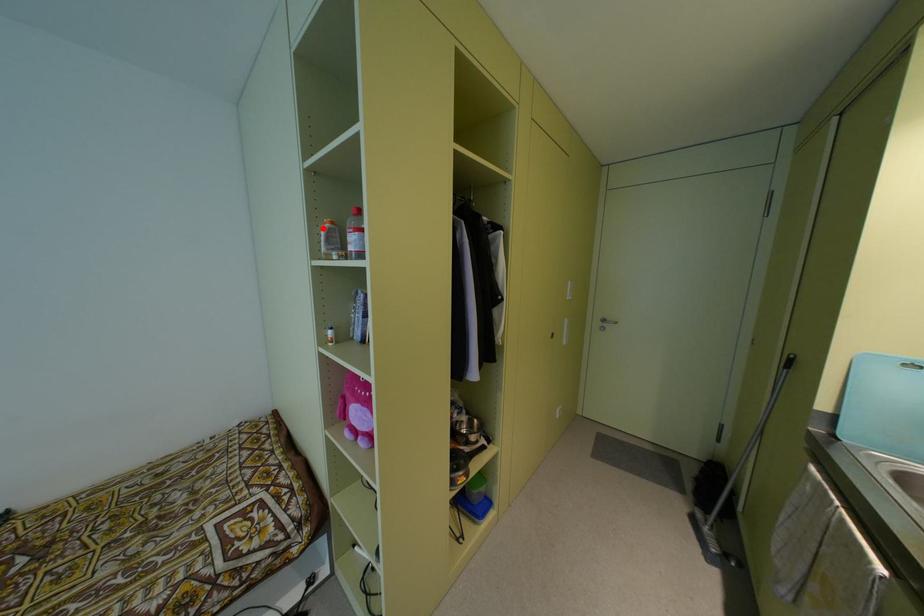
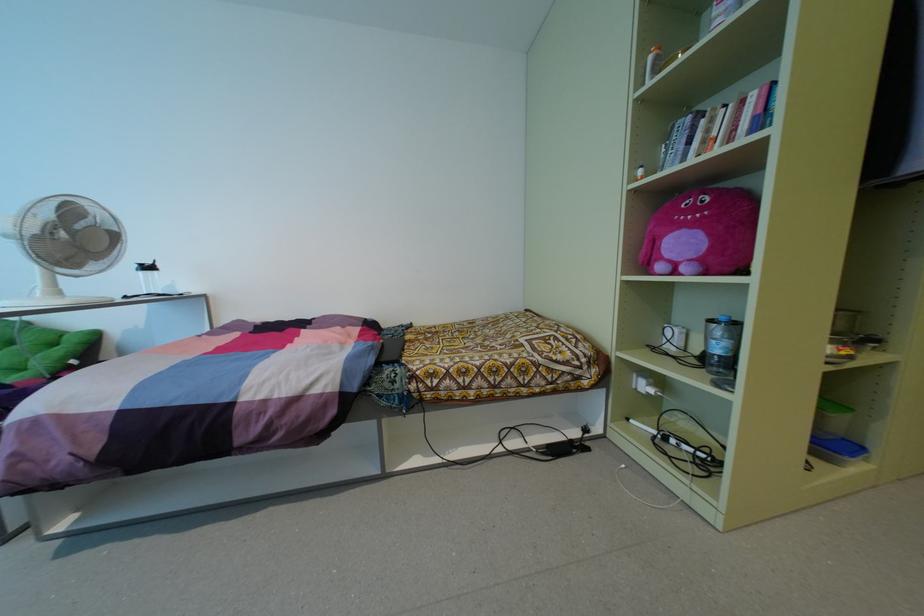
The point at the highlighted location is marked in the first image. Where is the corresponding point in the second image?

(650, 57)